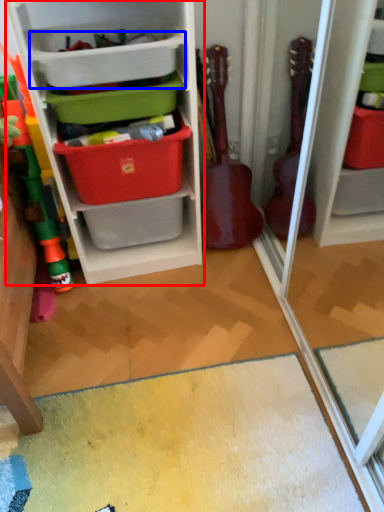
Question: Which object appears closest to the camera in this image, shelf (highlighted by a red box) or storage box (highlighted by a blue box)?

Choices:
 (A) shelf
 (B) storage box

Answer: (A)